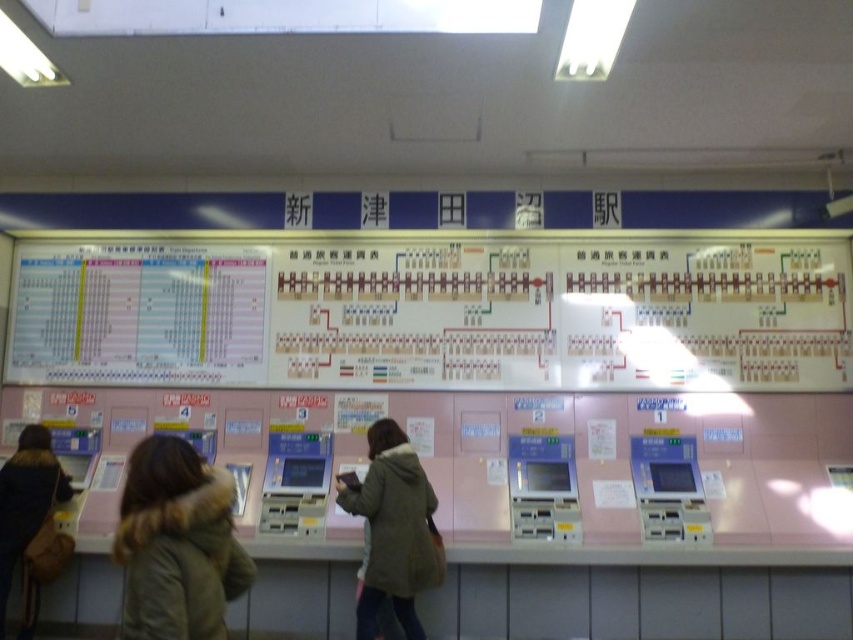
Question: From the image, what is the correct spatial relationship of brown fur-lined coat at lower left in relation to green fuzzy coat at center?

Choices:
 (A) left
 (B) right

Answer: (A)

Question: Which point is farther to the camera?

Choices:
 (A) (149, 627)
 (B) (381, 560)
 (C) (532, 340)
 (D) (21, 476)

Answer: (C)

Question: Is brown fur-lined coat at lower left below light brown fur coat at lower left?

Choices:
 (A) no
 (B) yes

Answer: (A)

Question: Can you confirm if white paper at center is positioned to the left of green fuzzy coat at center?

Choices:
 (A) no
 (B) yes

Answer: (B)

Question: Based on their relative distances, which object is nearer to the brown fur-lined coat at lower left?

Choices:
 (A) white paper at center
 (B) light brown fur coat at lower left
 (C) green fuzzy coat at center

Answer: (C)

Question: Based on their relative distances, which object is farther from the brown fur-lined coat at lower left?

Choices:
 (A) white paper at center
 (B) green fuzzy coat at center
 (C) light brown fur coat at lower left

Answer: (A)